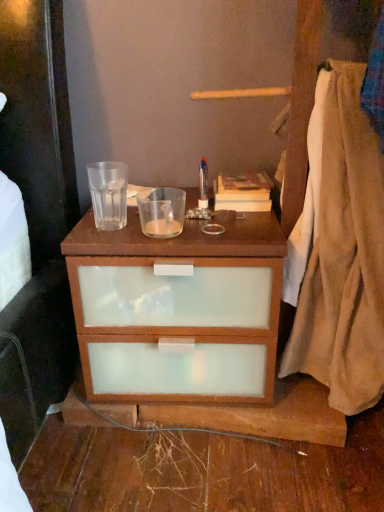
Question: Can hardcover book at upper right be found inside beige cotton blanket at right?

Choices:
 (A) no
 (B) yes

Answer: (A)

Question: Is beige cotton blanket at right at the left side of hardcover book at upper right?

Choices:
 (A) yes
 (B) no

Answer: (B)

Question: Is beige cotton blanket at right in front of hardcover book at upper right?

Choices:
 (A) yes
 (B) no

Answer: (A)

Question: Is beige cotton blanket at right directly adjacent to hardcover book at upper right?

Choices:
 (A) no
 (B) yes

Answer: (A)

Question: From the image's perspective, is beige cotton blanket at right located beneath hardcover book at upper right?

Choices:
 (A) no
 (B) yes

Answer: (B)

Question: Does beige cotton blanket at right have a greater width compared to hardcover book at upper right?

Choices:
 (A) yes
 (B) no

Answer: (A)

Question: From the image's perspective, is hardcover book at upper right under beige cotton blanket at right?

Choices:
 (A) no
 (B) yes

Answer: (A)

Question: Does hardcover book at upper right have a smaller size compared to beige cotton blanket at right?

Choices:
 (A) no
 (B) yes

Answer: (B)

Question: Is hardcover book at upper right not within beige cotton blanket at right?

Choices:
 (A) no
 (B) yes

Answer: (B)

Question: Is hardcover book at upper right aimed at beige cotton blanket at right?

Choices:
 (A) yes
 (B) no

Answer: (B)

Question: Is hardcover book at upper right facing away from beige cotton blanket at right?

Choices:
 (A) yes
 (B) no

Answer: (B)

Question: Is hardcover book at upper right taller than beige cotton blanket at right?

Choices:
 (A) yes
 (B) no

Answer: (B)

Question: From the image's perspective, is hardcover book at upper right positioned above or below beige cotton blanket at right?

Choices:
 (A) above
 (B) below

Answer: (A)